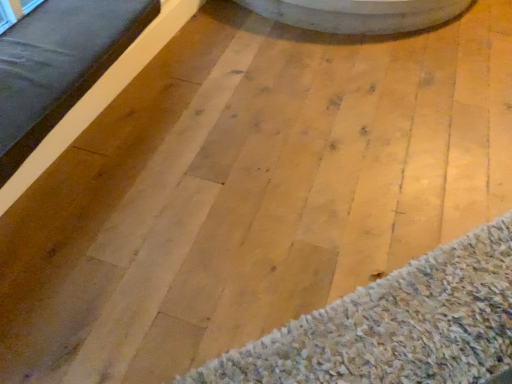
This screenshot has height=384, width=512. What are the coordinates of `vacant space that is to the left of woolen carpet at lower right` in the screenshot? It's located at (166, 251).